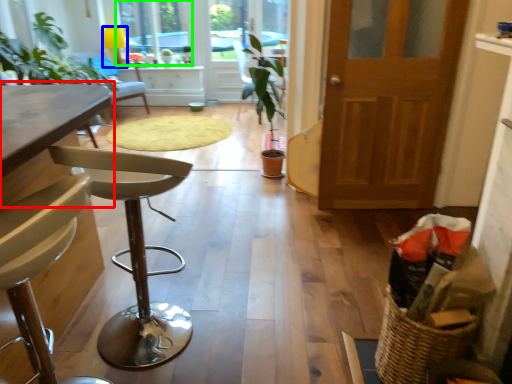
Question: Which object is positioned farthest from table (highlighted by a red box)? Select from lamp (highlighted by a blue box) and window (highlighted by a green box).

Choices:
 (A) lamp
 (B) window

Answer: (A)